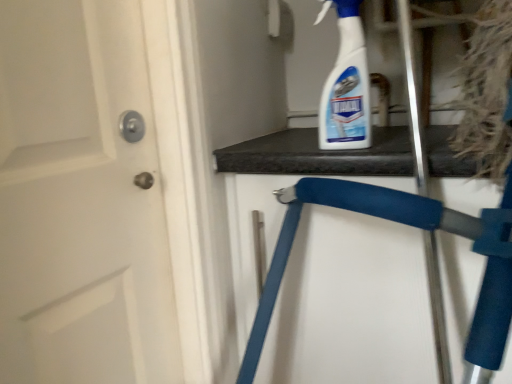
The image size is (512, 384). Identify the location of empty space that is to the right of white plastic spray bottle at upper right. (413, 142).